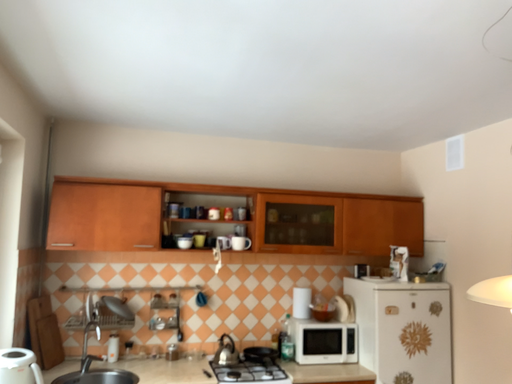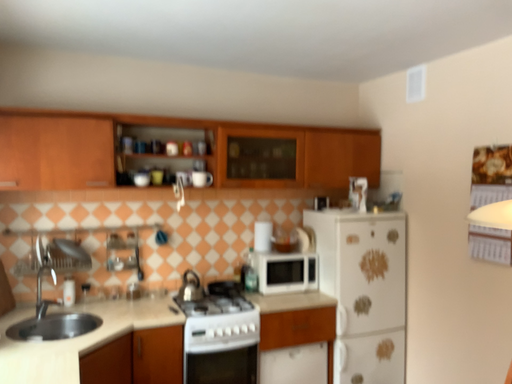
Question: Which way did the camera rotate in the video?

Choices:
 (A) rotated upward
 (B) rotated downward

Answer: (B)